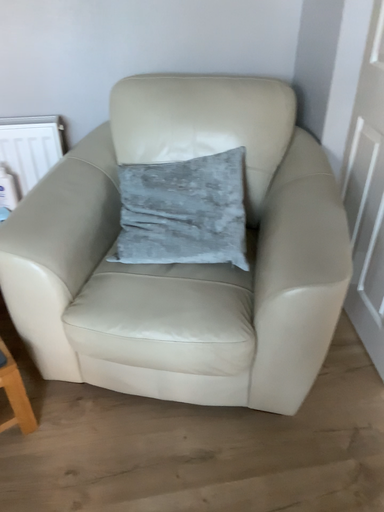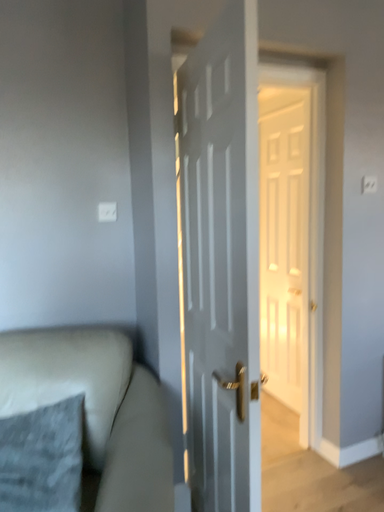
Question: Which way did the camera rotate in the video?

Choices:
 (A) rotated left
 (B) rotated right

Answer: (B)